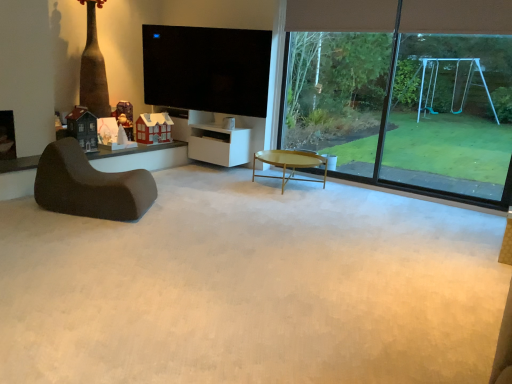
Question: Should I look upward or downward to see white matte cabinet at center?

Choices:
 (A) down
 (B) up

Answer: (B)

Question: Could you tell me if flat screen tv at upper center is turned towards green leafy tree at upper right?

Choices:
 (A) yes
 (B) no

Answer: (B)

Question: Can you confirm if flat screen tv at upper center is taller than green leafy tree at upper right?

Choices:
 (A) yes
 (B) no

Answer: (B)

Question: Can you confirm if flat screen tv at upper center is wider than green leafy tree at upper right?

Choices:
 (A) no
 (B) yes

Answer: (B)

Question: Is the position of flat screen tv at upper center less distant than that of green leafy tree at upper right?

Choices:
 (A) no
 (B) yes

Answer: (A)

Question: Is flat screen tv at upper center beside green leafy tree at upper right?

Choices:
 (A) no
 (B) yes

Answer: (A)

Question: Is green leafy tree at upper right surrounded by flat screen tv at upper center?

Choices:
 (A) yes
 (B) no

Answer: (B)

Question: Considering the relative sizes of matte black house at left, the 3th toy viewed from the right, and green leafy tree at upper right in the image provided, is matte black house at left, the 3th toy viewed from the right, wider than green leafy tree at upper right?

Choices:
 (A) yes
 (B) no

Answer: (A)

Question: From a real-world perspective, is matte black house at left, which is the first toy from left to right, on green leafy tree at upper right?

Choices:
 (A) yes
 (B) no

Answer: (B)

Question: Does matte black house at left, the 3th toy viewed from the right, have a greater height compared to green leafy tree at upper right?

Choices:
 (A) yes
 (B) no

Answer: (B)

Question: Is matte black house at left, marked as the first toy in a front-to-back arrangement, directly adjacent to green leafy tree at upper right?

Choices:
 (A) yes
 (B) no

Answer: (B)

Question: From the image's perspective, does matte black house at left, which is the first toy from left to right, appear higher than green leafy tree at upper right?

Choices:
 (A) no
 (B) yes

Answer: (A)

Question: Would you say matte black house at left, the 3th toy viewed from the right, is outside green leafy tree at upper right?

Choices:
 (A) no
 (B) yes

Answer: (B)

Question: Considering the relative sizes of matte black house at left, the third toy when ordered from back to front, and transparent glass swing set at right in the image provided, is matte black house at left, the third toy when ordered from back to front, wider than transparent glass swing set at right?

Choices:
 (A) yes
 (B) no

Answer: (A)